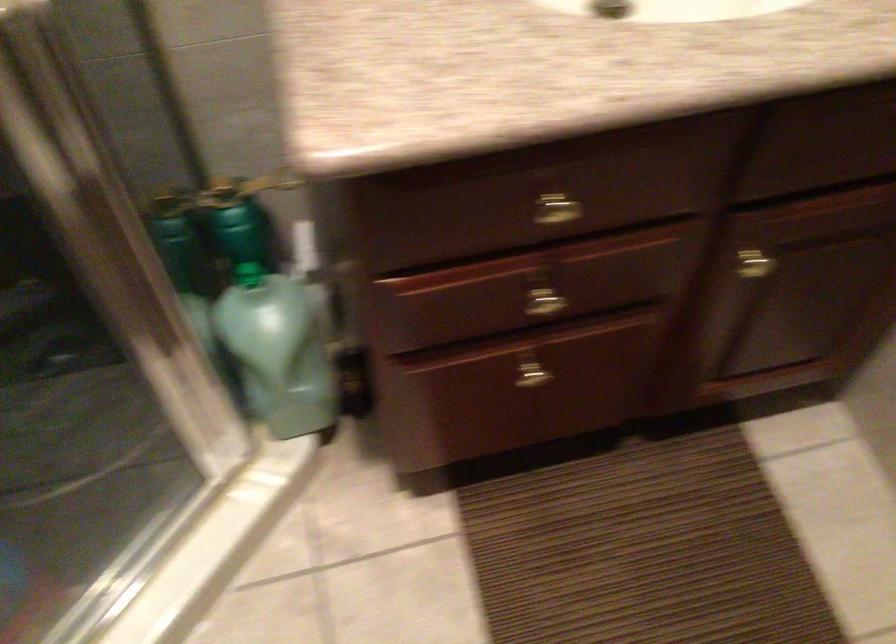
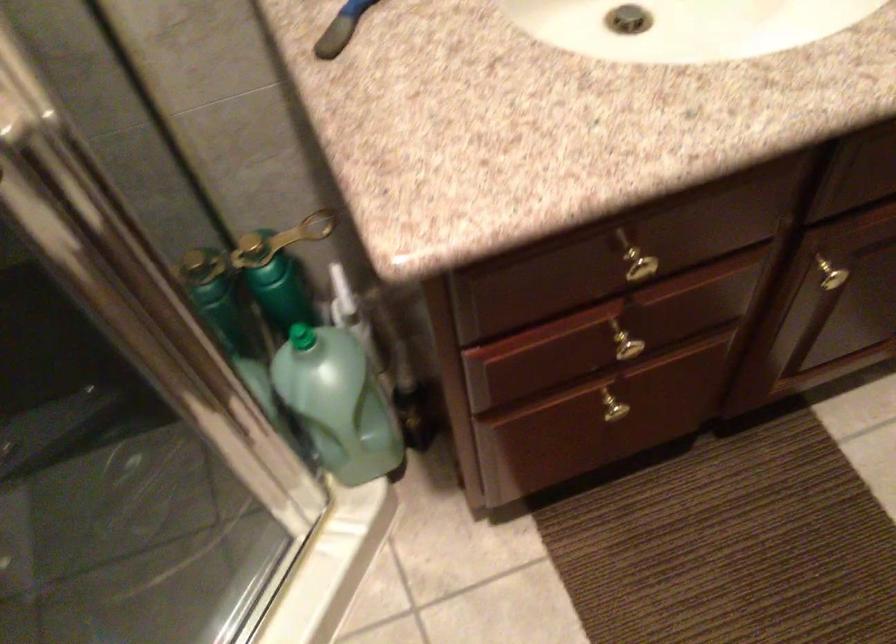
Find the pixel in the second image that matches [271,346] in the first image.

(338, 402)